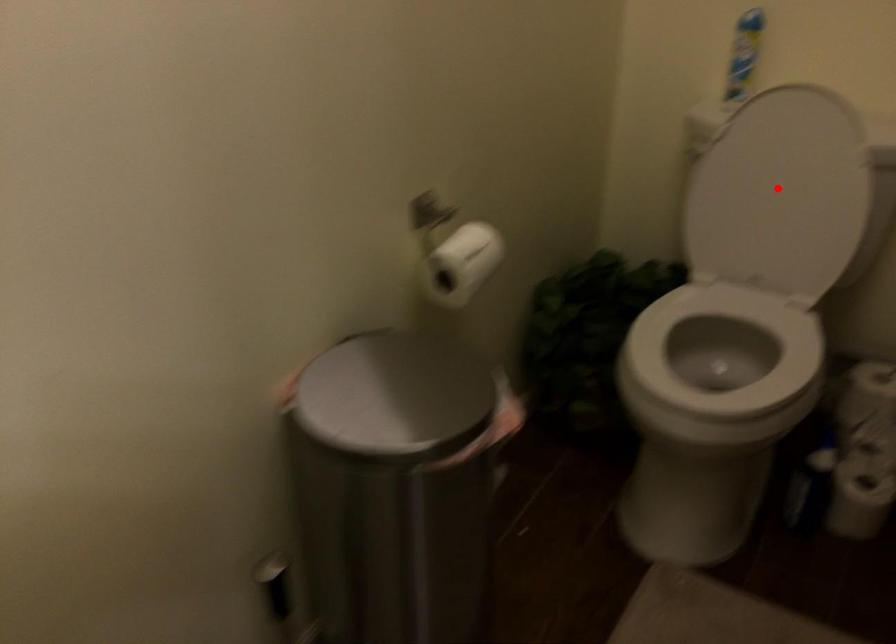
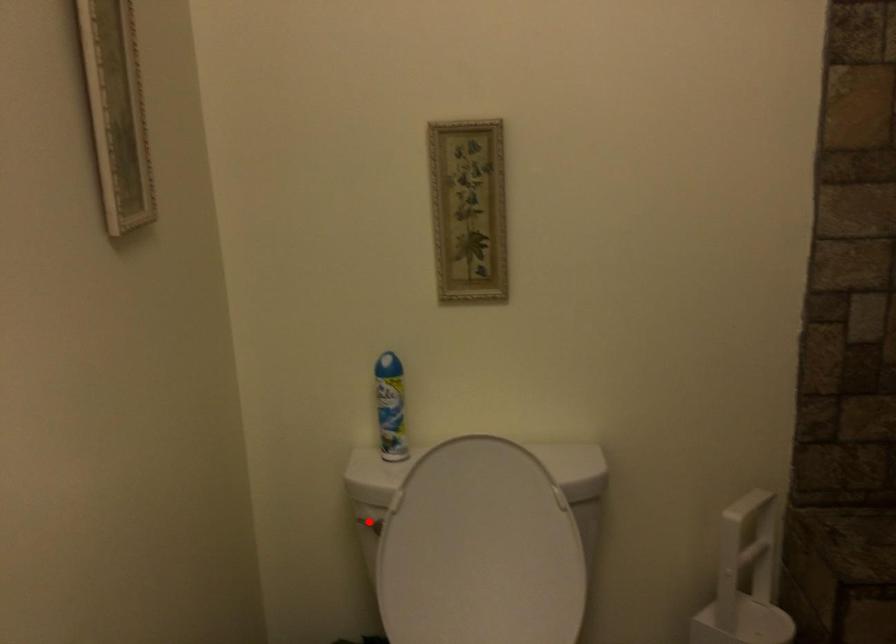
I am providing you with two images of the same scene from different viewpoints. A red point is marked on the first image and another point is marked on the second image. Is the red point in image1 aligned with the point shown in image2?

No